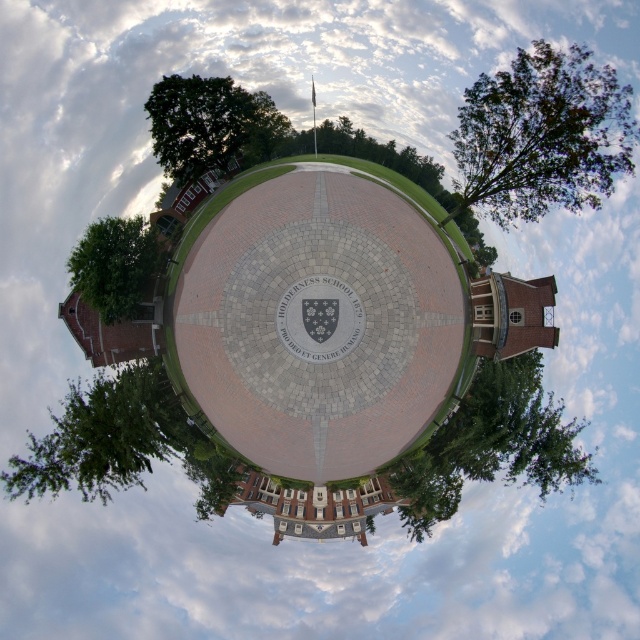
Question: Can you confirm if green leafy tree at upper right is positioned to the left of green leafy tree at left?

Choices:
 (A) yes
 (B) no

Answer: (B)

Question: Does green leafy tree at upper right have a larger size compared to green leafy tree at left?

Choices:
 (A) no
 (B) yes

Answer: (B)

Question: Does green leafy tree at upper right have a smaller size compared to green leafy tree at upper left?

Choices:
 (A) no
 (B) yes

Answer: (A)

Question: Which of the following is the farthest from the observer?

Choices:
 (A) [x=211, y=477]
 (B) [x=339, y=332]
 (C) [x=125, y=227]
 (D) [x=467, y=97]

Answer: (A)

Question: Which object is farther from the camera taking this photo?

Choices:
 (A) green leafy tree at upper right
 (B) green leafy tree at upper left
 (C) green leafy tree at left
 (D) gray stone clock at center

Answer: (B)

Question: Which point is farther to the camera?

Choices:
 (A) (131, 413)
 (B) (560, 170)

Answer: (A)